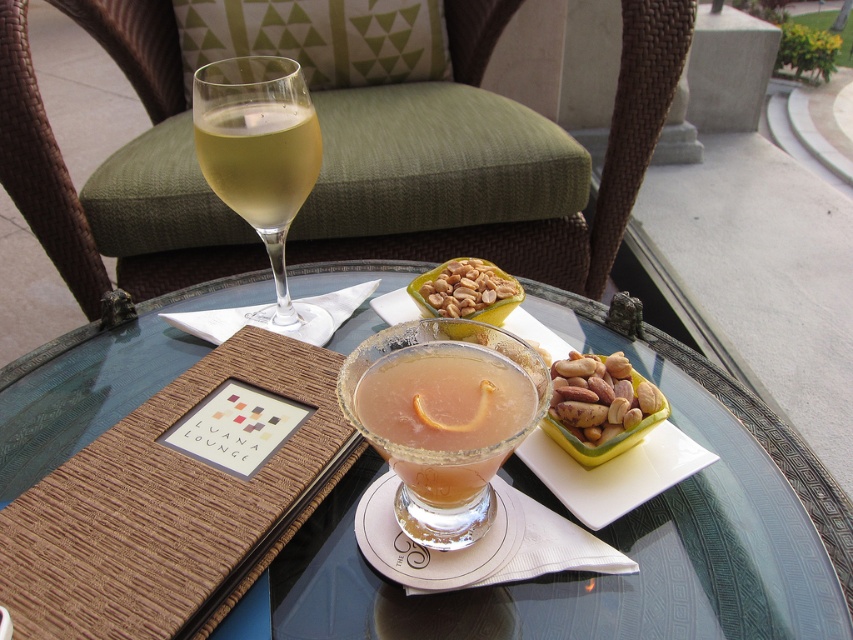
Question: Can you confirm if peanutsmoothat upper center is positioned to the right of shiny brown nuts at center?

Choices:
 (A) no
 (B) yes

Answer: (A)

Question: Does translucent glass wine glass at left appear on the right side of peanutsmoothat upper center?

Choices:
 (A) no
 (B) yes

Answer: (A)

Question: Which point is farther to the camera?

Choices:
 (A) (18, 140)
 (B) (485, 262)
 (C) (601, 356)
 (D) (308, 184)

Answer: (A)

Question: Estimate the real-world distances between objects in this image. Which object is farther from the clear glass wine at upper left?

Choices:
 (A) brown woven chair at upper center
 (B) translucent glass cocktail at center
 (C) shiny brown nuts at center
 (D) clear glass table at center

Answer: (A)

Question: In this image, where is translucent glass wine glass at left located relative to shiny brown nuts at center?

Choices:
 (A) right
 (B) left

Answer: (B)

Question: Which of these objects is positioned farthest from the brown woven chair at upper center?

Choices:
 (A) translucent glass cocktail at center
 (B) translucent glass wine glass at left

Answer: (A)